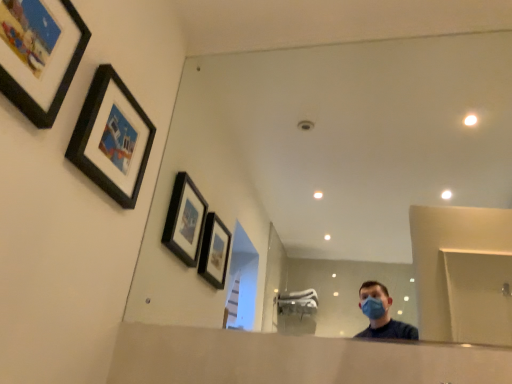
Question: Is matte black picture frame at upper left, arranged as the 2th picture frame when viewed from the back, in front of clear glass mirror at center?

Choices:
 (A) yes
 (B) no

Answer: (A)

Question: Is matte black picture frame at upper left, arranged as the 1th picture frame when viewed from the front, bigger than clear glass mirror at center?

Choices:
 (A) yes
 (B) no

Answer: (B)

Question: Can you confirm if matte black picture frame at upper left, arranged as the 2th picture frame when viewed from the back, is shorter than clear glass mirror at center?

Choices:
 (A) no
 (B) yes

Answer: (B)

Question: From the image's perspective, is matte black picture frame at upper left, arranged as the 1th picture frame when viewed from the front, under clear glass mirror at center?

Choices:
 (A) yes
 (B) no

Answer: (B)

Question: Is matte black picture frame at upper left, arranged as the 1th picture frame when viewed from the front, positioned far away from clear glass mirror at center?

Choices:
 (A) yes
 (B) no

Answer: (A)

Question: Considering the relative sizes of matte black picture frame at upper left, arranged as the 2th picture frame when viewed from the back, and clear glass mirror at center in the image provided, is matte black picture frame at upper left, arranged as the 2th picture frame when viewed from the back, taller than clear glass mirror at center?

Choices:
 (A) yes
 (B) no

Answer: (B)

Question: Is black matte picture frame at upper left, which is the second picture frame in front-to-back order, smaller than clear glass mirror at center?

Choices:
 (A) no
 (B) yes

Answer: (B)

Question: Does black matte picture frame at upper left, the first picture frame in the back-to-front sequence, have a lesser width compared to clear glass mirror at center?

Choices:
 (A) yes
 (B) no

Answer: (B)

Question: From the image's perspective, would you say black matte picture frame at upper left, which is the second picture frame in front-to-back order, is positioned over clear glass mirror at center?

Choices:
 (A) yes
 (B) no

Answer: (A)

Question: Is black matte picture frame at upper left, the first picture frame in the back-to-front sequence, facing towards clear glass mirror at center?

Choices:
 (A) yes
 (B) no

Answer: (A)

Question: From a real-world perspective, is black matte picture frame at upper left, which is the second picture frame in front-to-back order, located beneath clear glass mirror at center?

Choices:
 (A) yes
 (B) no

Answer: (A)

Question: Is clear glass mirror at center at the back of black matte picture frame at upper left, the first picture frame in the back-to-front sequence?

Choices:
 (A) yes
 (B) no

Answer: (B)

Question: From the image's perspective, does clear glass mirror at center appear lower than matte black picture frame at upper left, arranged as the 1th picture frame when viewed from the front?

Choices:
 (A) yes
 (B) no

Answer: (A)